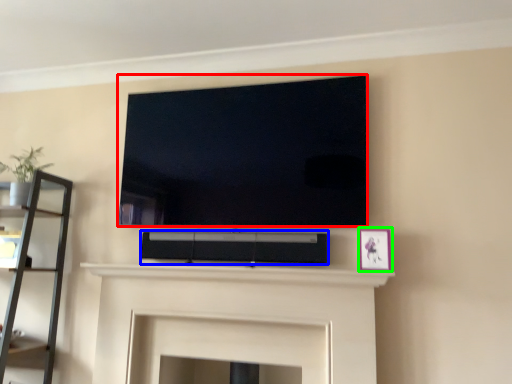
Question: Which object is the closest to the television (highlighted by a red box)? Choose among these: speaker (highlighted by a blue box) or picture frame (highlighted by a green box).

Choices:
 (A) speaker
 (B) picture frame

Answer: (A)